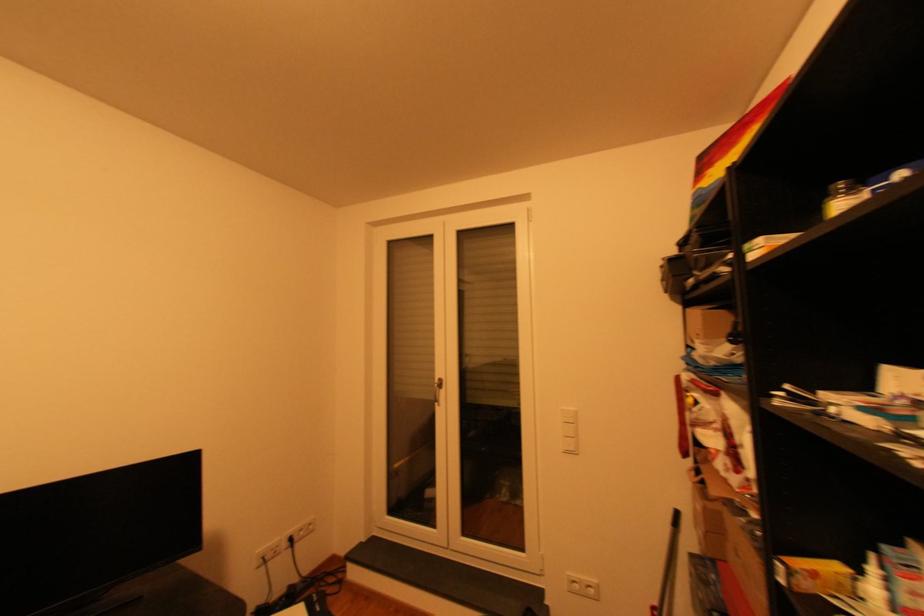
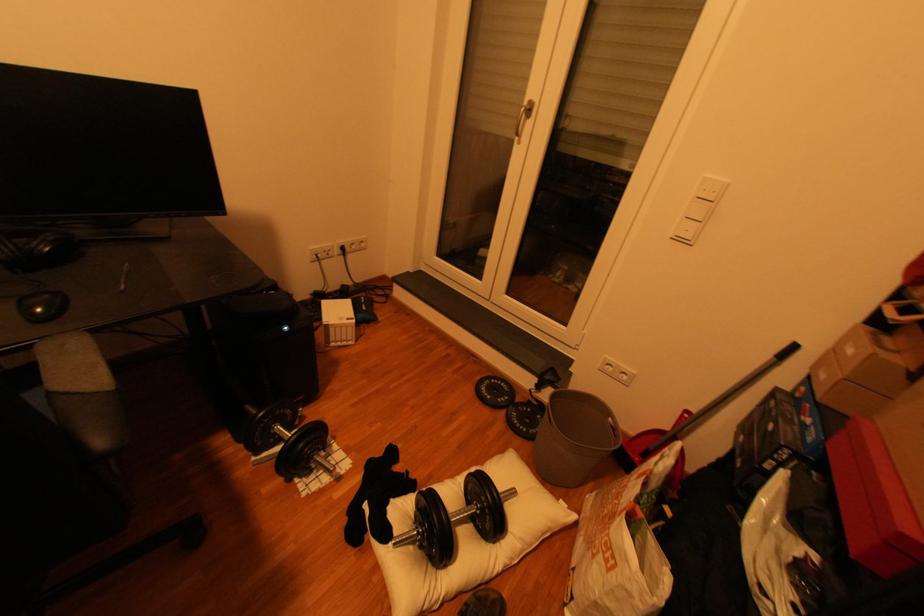
The point at (576, 453) is marked in the first image. Where is the corresponding point in the second image?

(687, 240)